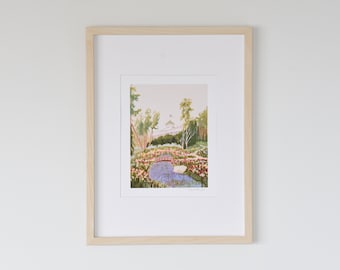
Image resolution: width=340 pixels, height=270 pixels. Identify the location of top left corner of frame. pyautogui.click(x=89, y=31).